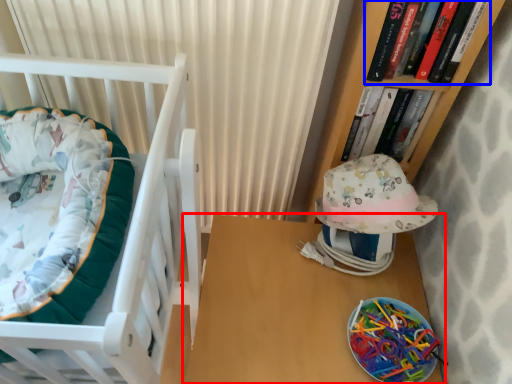
Question: Among these objects, which one is nearest to the camera, table (highlighted by a red box) or book (highlighted by a blue box)?

Choices:
 (A) table
 (B) book

Answer: (B)